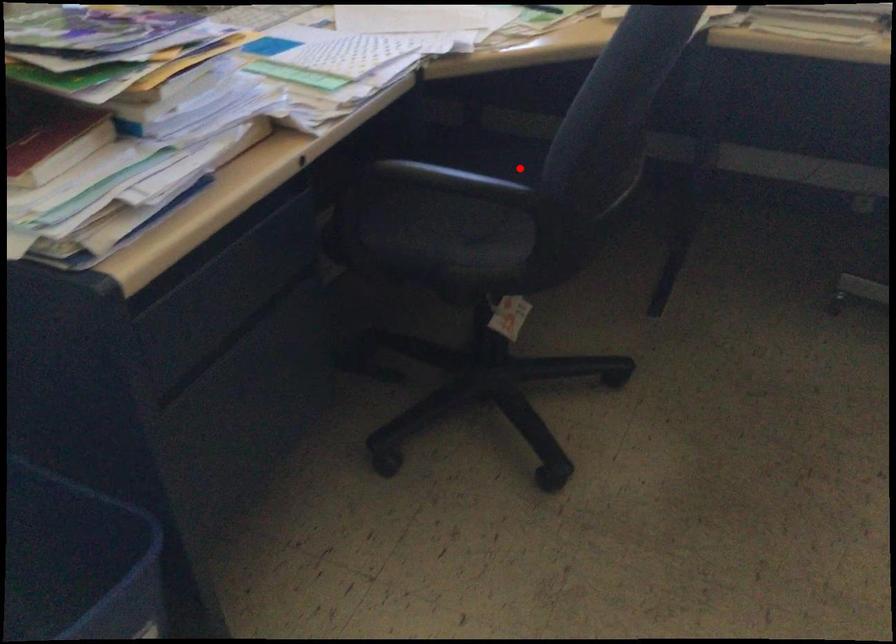
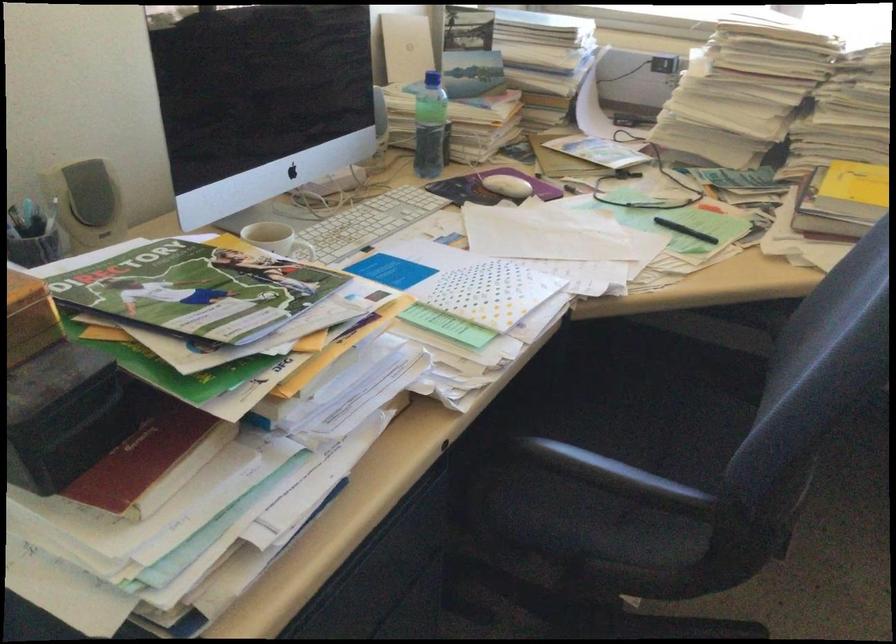
Question: I am providing you with two images of the same scene from different viewpoints. A red point is shown in image1. For the corresponding object point in image2, is it positioned nearer or farther from the camera?

Choices:
 (A) Nearer
 (B) Farther

Answer: (A)